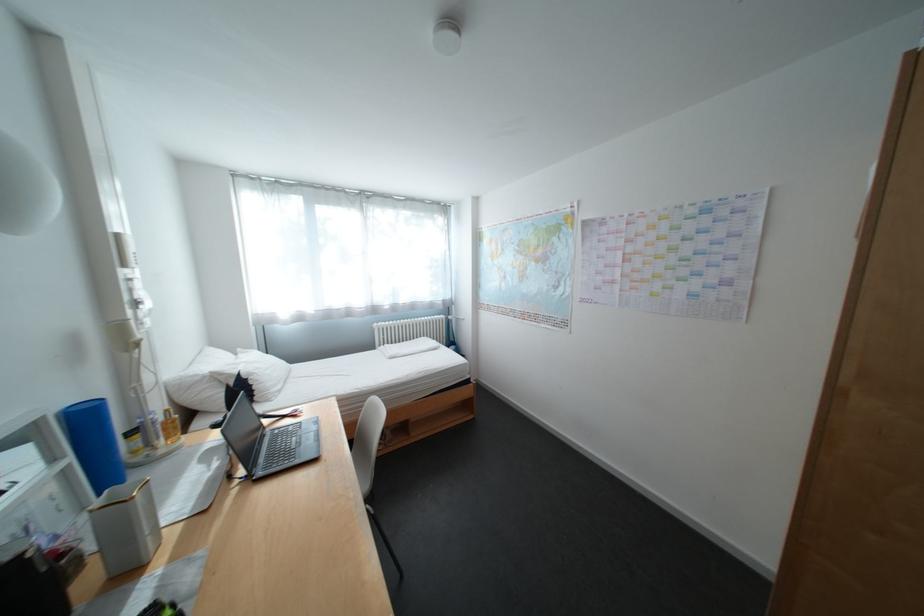
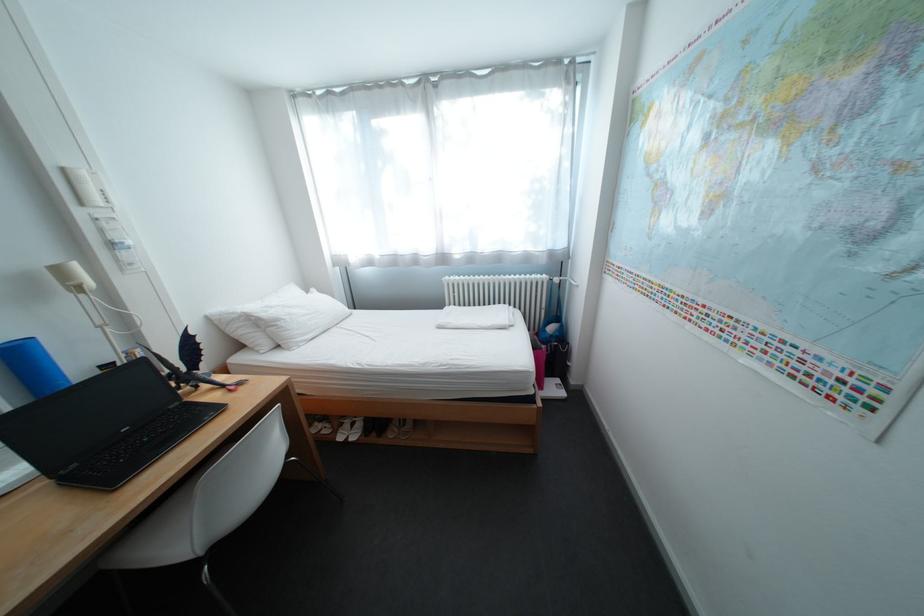
Find the pixel in the second image that matches the point at 264,376 in the first image.

(292, 322)